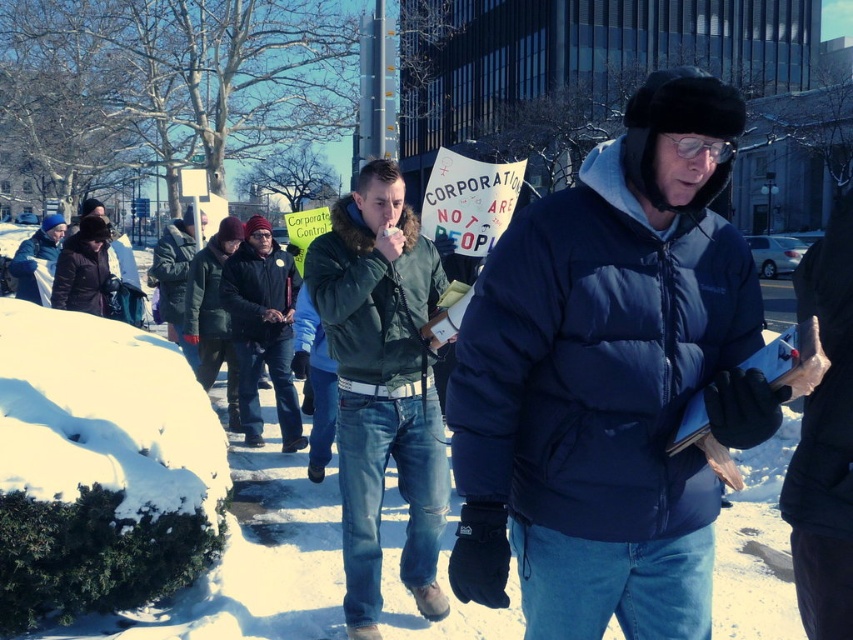
Question: Can you confirm if green matte jacket at center is positioned below dark green jacket at center?

Choices:
 (A) no
 (B) yes

Answer: (B)

Question: Is blue puffy jacket at center to the left of dark green jacket at center from the viewer's perspective?

Choices:
 (A) yes
 (B) no

Answer: (B)

Question: Is blue puffy jacket at center closer to the viewer compared to green matte jacket at center?

Choices:
 (A) no
 (B) yes

Answer: (B)

Question: Which is farther from the green matte jacket at center?

Choices:
 (A) matte black jacket at left
 (B) blue puffy jacket at center
 (C) dark green jacket at center
 (D) dark blue jacket at center

Answer: (A)

Question: Which of the following is the closest to the observer?

Choices:
 (A) blue puffy jacket at center
 (B) matte black jacket at left
 (C) dark blue jacket at center

Answer: (A)

Question: Among these points, which one is farthest from the camera?

Choices:
 (A) (166, 227)
 (B) (302, 435)
 (C) (369, 618)
 (D) (51, 218)

Answer: (A)